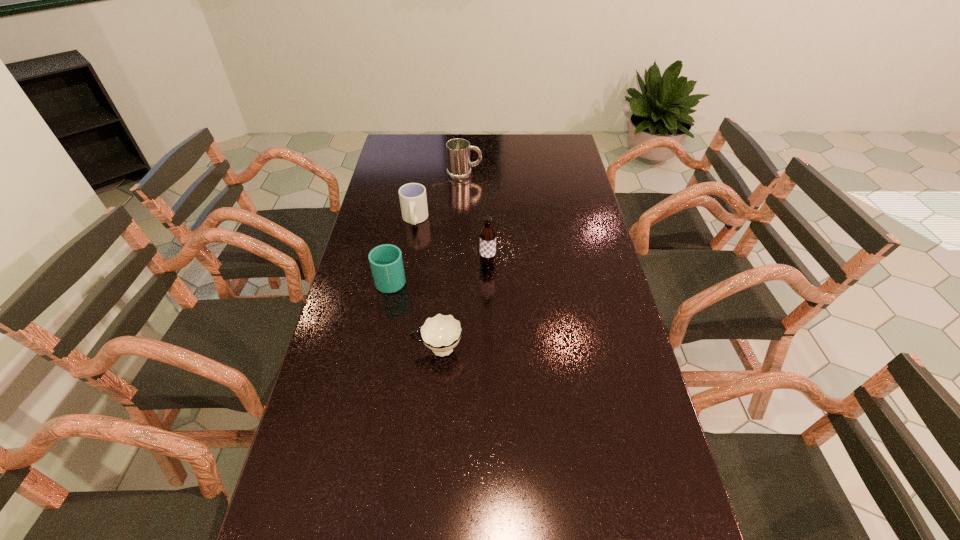
Where is `vacant area situated 0.340m on the handle side of the second nearest cup`? vacant area situated 0.340m on the handle side of the second nearest cup is located at coordinates (406, 204).

You are a GUI agent. You are given a task and a screenshot of the screen. Output one action in this format:
    pyautogui.click(x=<x>, y=<y>)
    Task: Click on the vacant point located with the handle on the side of the farthest cup
    
    Given the screenshot: What is the action you would take?
    pyautogui.click(x=408, y=261)

Where is `vacant space located 0.220m on the side of the second nearest object with the handle`? This screenshot has height=540, width=960. vacant space located 0.220m on the side of the second nearest object with the handle is located at coordinates (332, 350).

Where is `vacant space located 0.200m on the side of the second nearest object with the handle`? vacant space located 0.200m on the side of the second nearest object with the handle is located at coordinates (339, 350).

Where is `free space located on the side of the second nearest object with the handle`? free space located on the side of the second nearest object with the handle is located at coordinates (336, 350).

I want to click on blank space at the far edge of the desktop, so click(514, 146).

In the image, there is a desktop. Where is `free space at the left edge`? This screenshot has height=540, width=960. free space at the left edge is located at coordinates (374, 379).

Locate an element on the screen. Image resolution: width=960 pixels, height=540 pixels. vacant space at the right edge of the desktop is located at coordinates (605, 414).

At what (x,y) coordinates should I click in order to perform the action: click on vacant space at the far right corner of the desktop. Please return your answer as a coordinate pair (x, y). Image resolution: width=960 pixels, height=540 pixels. Looking at the image, I should click on (542, 134).

Where is `free space between the nearest cup and the mug`? free space between the nearest cup and the mug is located at coordinates (451, 262).